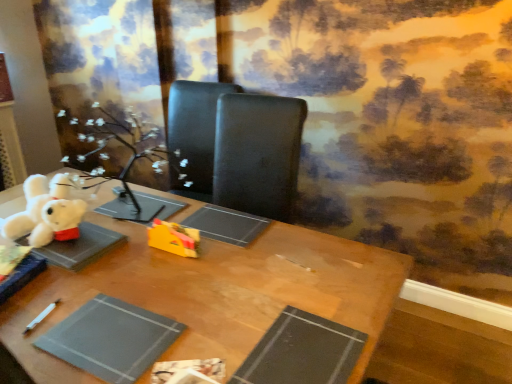
You are a GUI agent. You are given a task and a screenshot of the screen. Output one action in this format:
    pyautogui.click(x=<x>, y=<y>)
    Task: Click on the free spot to the right of gray matte paper at lower left, which ranks as the 2th paperback book in right-to-left order
    The height and width of the screenshot is (384, 512).
    Given the screenshot: What is the action you would take?
    pyautogui.click(x=206, y=318)